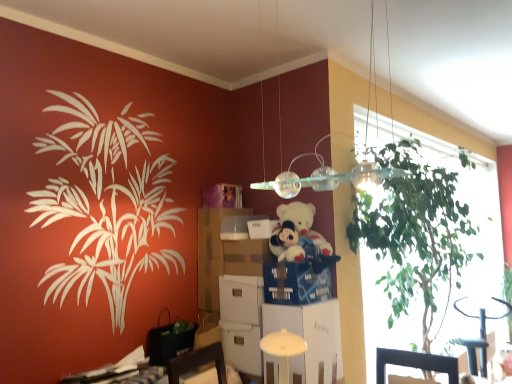
Question: From a real-world perspective, does white cardboard box at center sit lower than white cardboard box at upper center, the 2th box positioned from the bottom?

Choices:
 (A) no
 (B) yes

Answer: (B)

Question: From the image's perspective, does white cardboard box at center appear lower than white cardboard box at upper center, the second box from the top?

Choices:
 (A) yes
 (B) no

Answer: (A)

Question: Would you consider white cardboard box at center to be distant from white cardboard box at upper center, the 2th box positioned from the bottom?

Choices:
 (A) yes
 (B) no

Answer: (B)

Question: Does white cardboard box at center have a larger size compared to white cardboard box at upper center, the second box from the top?

Choices:
 (A) yes
 (B) no

Answer: (A)

Question: Considering the relative sizes of white cardboard box at center and white cardboard box at upper center, the second box from the top, in the image provided, is white cardboard box at center taller than white cardboard box at upper center, the second box from the top,?

Choices:
 (A) no
 (B) yes

Answer: (B)

Question: Does white cardboard box at center have a greater width compared to white cardboard box at upper center, the second box from the top?

Choices:
 (A) yes
 (B) no

Answer: (A)

Question: From the image's perspective, would you say white cardboard box at upper center, the 2th box positioned from the bottom, is positioned over cardboard drawer at center, the second drawer positioned from the right?

Choices:
 (A) no
 (B) yes

Answer: (B)

Question: From the image's perspective, would you say white cardboard box at upper center, the second box from the top, is shown under cardboard drawer at center, the 1th drawer viewed from the left?

Choices:
 (A) no
 (B) yes

Answer: (A)

Question: Is white cardboard box at upper center, the second box from the top, closer to the viewer compared to cardboard drawer at center, the 1th drawer viewed from the left?

Choices:
 (A) yes
 (B) no

Answer: (B)

Question: Does white cardboard box at upper center, the 2th box positioned from the bottom, appear on the left side of cardboard drawer at center, the 1th drawer viewed from the left?

Choices:
 (A) no
 (B) yes

Answer: (B)

Question: Does white cardboard box at upper center, the 2th box positioned from the bottom, have a greater width compared to cardboard drawer at center, the second drawer positioned from the right?

Choices:
 (A) yes
 (B) no

Answer: (B)

Question: Could you tell me if white cardboard box at upper center, the second box from the top, is turned towards cardboard drawer at center, the 1th drawer viewed from the left?

Choices:
 (A) yes
 (B) no

Answer: (B)

Question: From a real-world perspective, is white cardboard box at center, positioned as the 3th box in top-to-bottom order, under blue cardboard drawer at center, marked as the first drawer in a right-to-left arrangement?

Choices:
 (A) no
 (B) yes

Answer: (A)